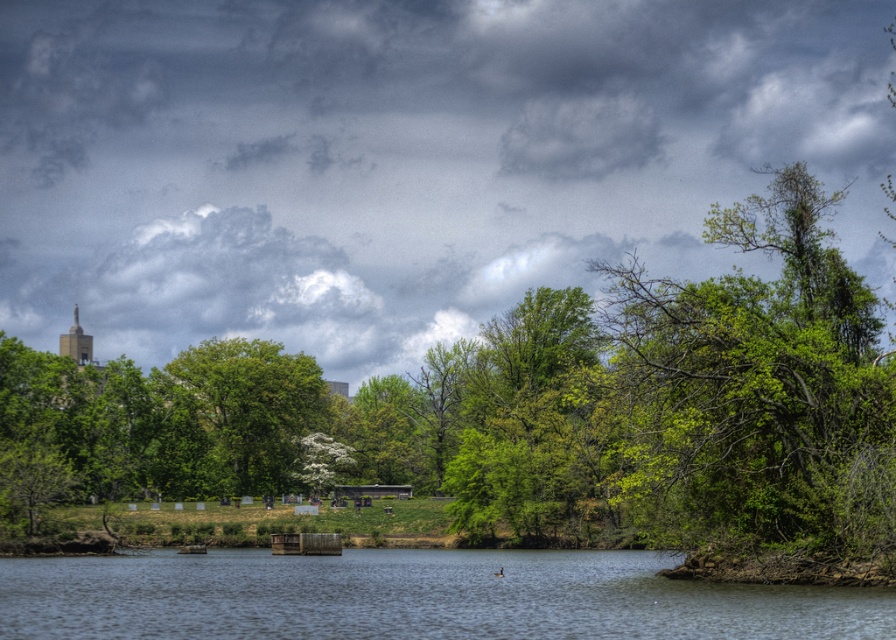
Question: Where is clear water at center located in relation to green leafy tree at center in the image?

Choices:
 (A) above
 (B) below

Answer: (B)

Question: Which of the following is the closest to the observer?

Choices:
 (A) green leafy tree at center
 (B) clear water at center

Answer: (B)

Question: Can you confirm if clear water at center is positioned below green leafy tree at center?

Choices:
 (A) no
 (B) yes

Answer: (B)

Question: Which point is closer to the camera?

Choices:
 (A) (293, 362)
 (B) (481, 627)

Answer: (B)

Question: Is clear water at center bigger than green leafy tree at center?

Choices:
 (A) yes
 (B) no

Answer: (A)